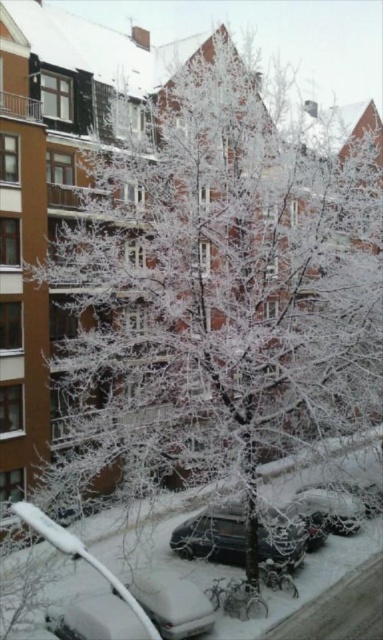
Is shiny black car at center taller than white matte car at lower left?

Correct, shiny black car at center is much taller as white matte car at lower left.

Which is behind, point (276, 513) or point (209, 605)?

Point (276, 513)

Between point (237, 532) and point (114, 589), which one is positioned in front?

Point (114, 589)

Locate an element on the screen. This screenshot has height=640, width=383. shiny black car at center is located at coordinates (212, 534).

Does shiny black car at center appear under white frosted car at center?

Yes.

Image resolution: width=383 pixels, height=640 pixels. I want to click on shiny black car at center, so click(212, 534).

Identify the location of shiny black car at center. The width and height of the screenshot is (383, 640). (212, 534).

Is point (178, 605) closer to viewer compared to point (312, 509)?

That is True.

Which of these two, white matte car at lower left or white frosted car at center, stands shorter?

white matte car at lower left

Locate an element on the screen. The image size is (383, 640). white matte car at lower left is located at coordinates (173, 604).